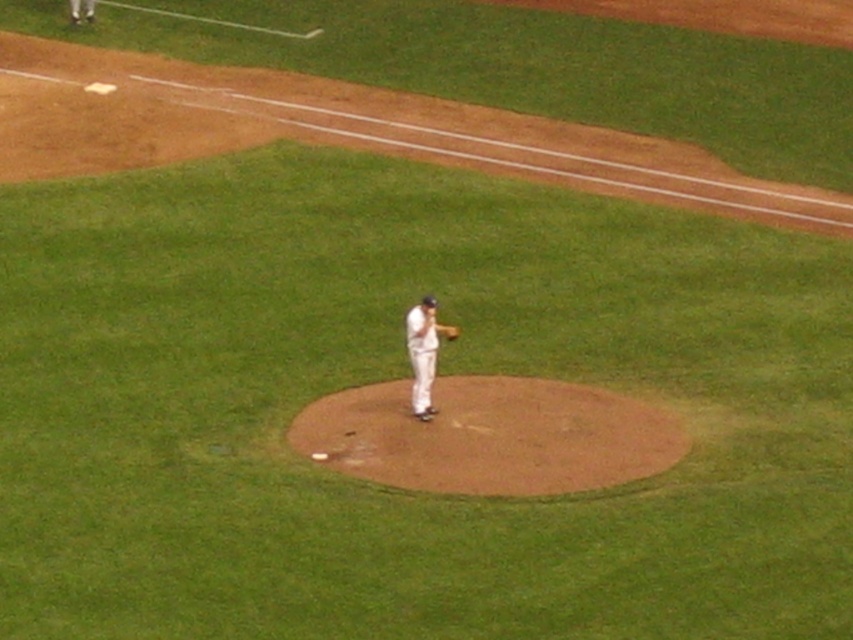
You are a photographer trying to capture the baseball pitcher in the white uniform at center and the white fabric pants at upper left. Which object should you focus on first if you want to photograph the larger one?

The white uniform at center is bigger than the white fabric pants at upper left, so you should focus on the white uniform at center first.

You are a baseball player standing at home plate and need to run to first base. The brown dirt mound at center is in your path. Can you safely navigate around it without stepping on the mound?

The brown dirt mound at center is located at point (491, 436), so yes, you can safely navigate around it as long as you avoid stepping on the mound itself.